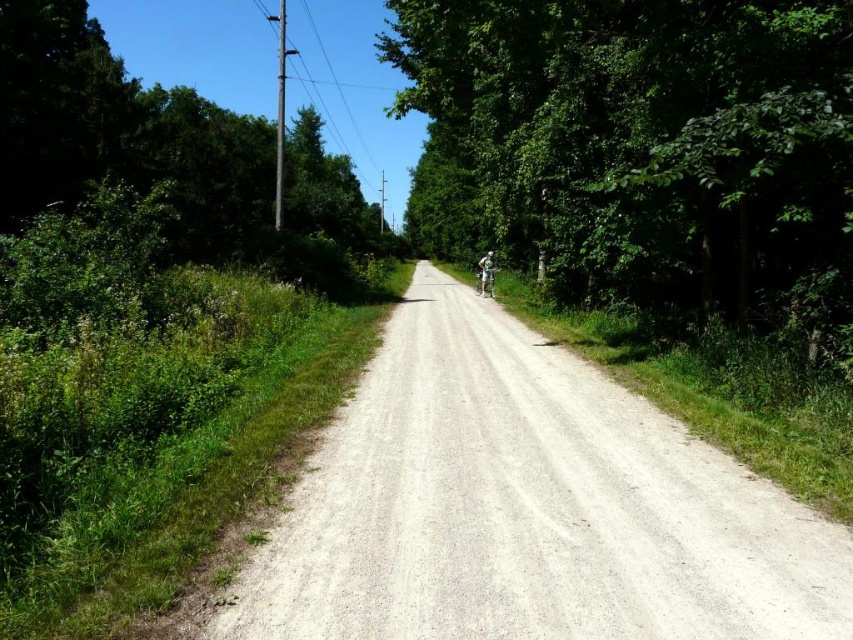
Question: Which of the following is the farthest from the observer?

Choices:
 (A) (494, 269)
 (B) (831, 88)
 (C) (625, 605)
 (D) (102, 144)

Answer: (D)

Question: Which object appears closest to the camera in this image?

Choices:
 (A) green leafy tree at left
 (B) green leafy tree at center

Answer: (B)

Question: Is gray gravel road at center thinner than green leafy tree at center?

Choices:
 (A) yes
 (B) no

Answer: (A)

Question: Is gray gravel road at center wider than green leafy tree at center?

Choices:
 (A) yes
 (B) no

Answer: (B)

Question: Which of the following is the farthest from the observer?

Choices:
 (A) (489, 276)
 (B) (329, 237)
 (C) (439, 380)
 (D) (811, 76)

Answer: (B)

Question: Can you confirm if green leafy tree at center is positioned below metallic silver bicycle at center?

Choices:
 (A) yes
 (B) no

Answer: (B)